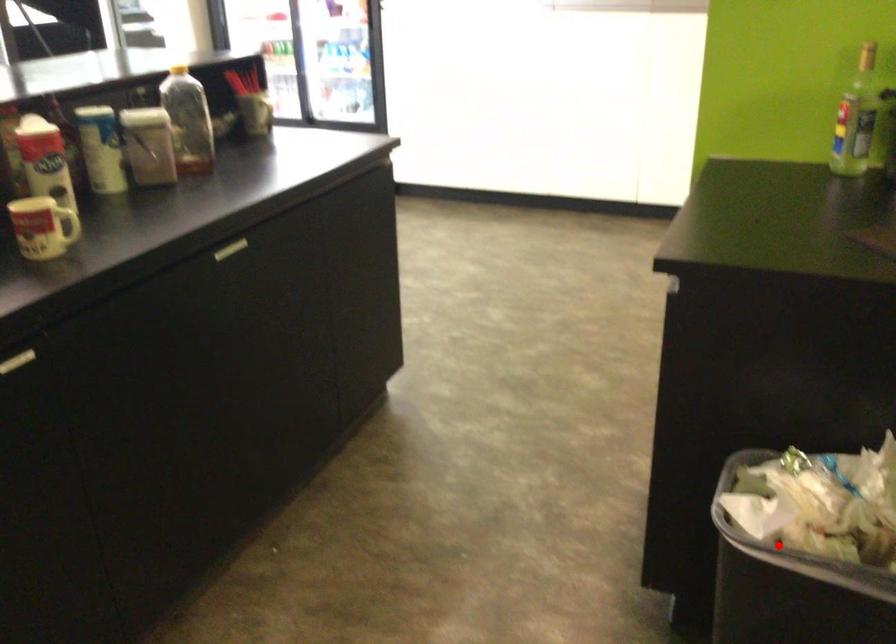
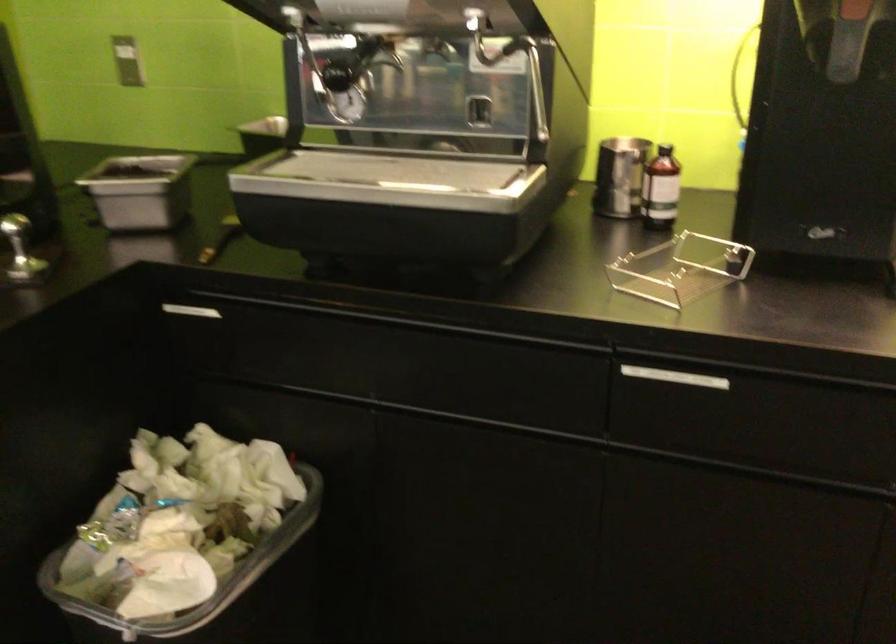
Question: I am providing you with two images of the same scene from different viewpoints. A red point is shown in image1. For the corresponding object point in image2, is it positioned nearer or farther from the camera?

Choices:
 (A) Nearer
 (B) Farther

Answer: (A)